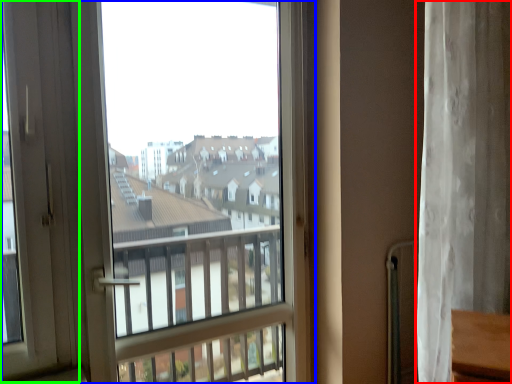
Question: Considering the real-world distances, which object is farthest from curtain (highlighted by a red box)? window (highlighted by a blue box) or screen door (highlighted by a green box)?

Choices:
 (A) window
 (B) screen door

Answer: (B)